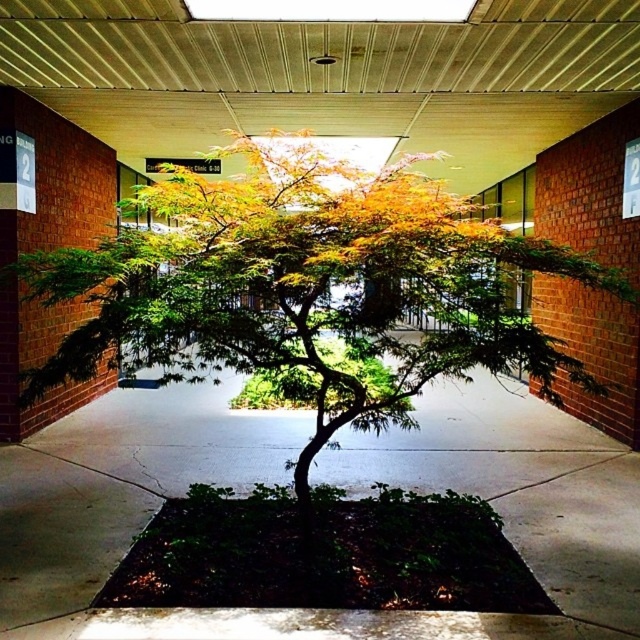
Question: Does green leafy tree at center appear on the right side of green concrete pavement at center?

Choices:
 (A) no
 (B) yes

Answer: (A)

Question: Can you confirm if green leafy tree at center is wider than green concrete pavement at center?

Choices:
 (A) no
 (B) yes

Answer: (B)

Question: Which point is closer to the camera?

Choices:
 (A) green leafy tree at center
 (B) green concrete pavement at center

Answer: (A)

Question: Is green leafy tree at center wider than green concrete pavement at center?

Choices:
 (A) yes
 (B) no

Answer: (A)